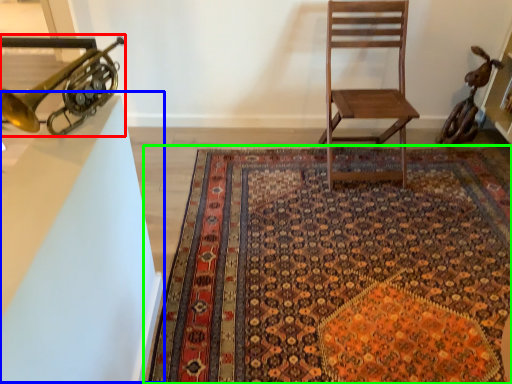
Question: Which object is positioned closest to trumpet (highlighted by a red box)? Select from table (highlighted by a blue box) and mat (highlighted by a green box).

Choices:
 (A) table
 (B) mat

Answer: (A)